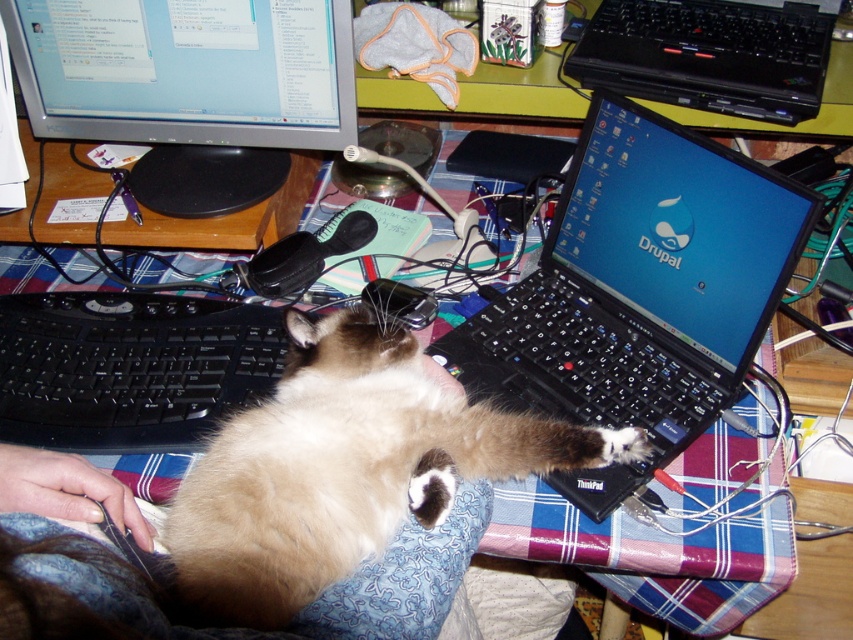
Question: Based on their relative distances, which object is nearer to the black plastic keyboard at center?

Choices:
 (A) silver metallic monitor at upper left
 (B) black plastic laptop at upper right
 (C) siamese fur cat at center
 (D) black plastic laptop at center

Answer: (C)

Question: Does black plastic laptop at center appear under black plastic keyboard at center?

Choices:
 (A) yes
 (B) no

Answer: (B)

Question: Is black plastic laptop at center above silver metallic monitor at upper left?

Choices:
 (A) yes
 (B) no

Answer: (B)

Question: Which object appears farthest from the camera in this image?

Choices:
 (A) black plastic keyboard at center
 (B) siamese fur cat at center
 (C) silver metallic monitor at upper left

Answer: (C)

Question: In this image, where is siamese fur cat at center located relative to black plastic keyboard at center?

Choices:
 (A) above
 (B) below

Answer: (B)

Question: Which point is farther from the camera taking this photo?

Choices:
 (A) [x=207, y=408]
 (B) [x=288, y=125]
 (C) [x=560, y=253]
 (D) [x=213, y=534]

Answer: (B)